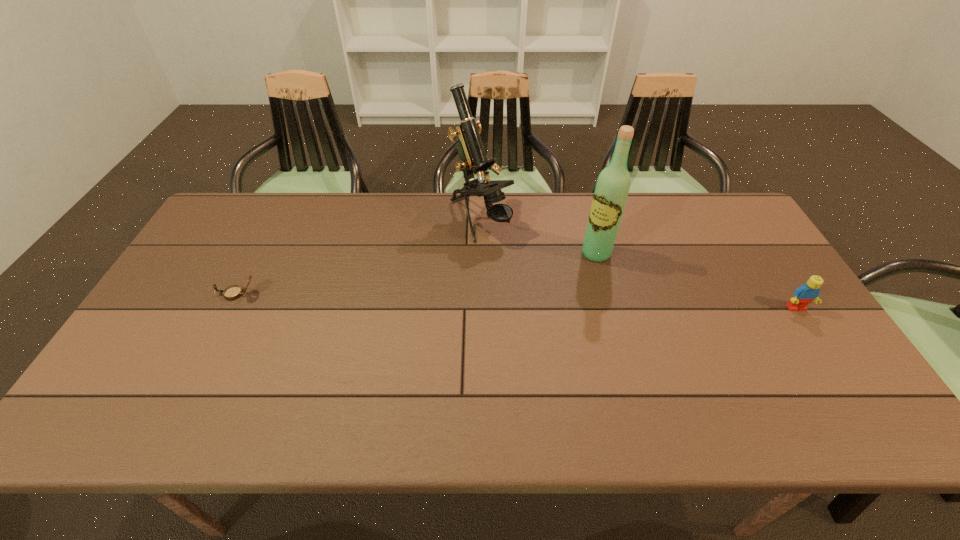
Where is `compass`? compass is located at coordinates (232, 292).

Find the location of `the third farthest object`. the third farthest object is located at coordinates (232, 292).

At what (x,y) coordinates should I click in order to perform the action: click on the rightmost object. Please return your answer as a coordinate pair (x, y). Looking at the image, I should click on (803, 295).

Locate an element on the screen. Image resolution: width=960 pixels, height=540 pixels. Lego is located at coordinates (803, 295).

Where is `the third object from left to right`? The image size is (960, 540). the third object from left to right is located at coordinates (612, 188).

Where is `microscope`? microscope is located at coordinates (473, 158).

Locate an element on the screen. Image resolution: width=960 pixels, height=540 pixels. vacant region located 0.140m on the face of the compass is located at coordinates (166, 294).

Find the location of a particular element. The width and height of the screenshot is (960, 540). blank area located on the face of the compass is located at coordinates (187, 294).

The width and height of the screenshot is (960, 540). Find the location of `vacant space located on the face of the compass`. vacant space located on the face of the compass is located at coordinates (180, 294).

The width and height of the screenshot is (960, 540). I want to click on vacant region located 0.130m on the face of the rightmost object, so click(x=826, y=354).